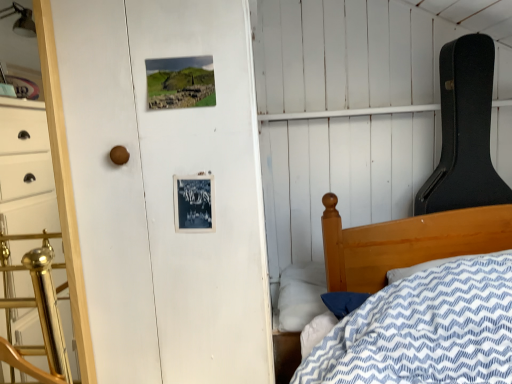
I want to click on white soft pillow at lower center, so click(x=301, y=295).

This screenshot has width=512, height=384. Describe the element at coordinates (301, 295) in the screenshot. I see `white soft pillow at lower center` at that location.

Locate an element on the screen. The width and height of the screenshot is (512, 384). brushed brass dresser at left is located at coordinates (30, 234).

The width and height of the screenshot is (512, 384). What do you see at coordinates (30, 234) in the screenshot?
I see `brushed brass dresser at left` at bounding box center [30, 234].

At what (x,y) coordinates should I click in order to perform the action: click on white soft pillow at lower center. Please return your answer as a coordinate pair (x, y). This screenshot has height=384, width=512. Looking at the image, I should click on (301, 295).

In the image, is brushed brass dresser at left on the left side or the right side of white soft pillow at lower center?

From the image, it's evident that brushed brass dresser at left is to the left of white soft pillow at lower center.

Which is behind, brushed brass dresser at left or white soft pillow at lower center?

white soft pillow at lower center.

Considering the positions of points (37, 311) and (282, 296), is point (37, 311) closer to camera compared to point (282, 296)?

Yes, point (37, 311) is in front of point (282, 296).

From the image's perspective, is brushed brass dresser at left located beneath white soft pillow at lower center?

No.

From a real-world perspective, which object stands above the other?

From a 3D spatial view, brushed brass dresser at left is above.

In the scene shown: Which object is wider, brushed brass dresser at left or white soft pillow at lower center?

With larger width is white soft pillow at lower center.

Between brushed brass dresser at left and white soft pillow at lower center, which one has more height?

brushed brass dresser at left is taller.

Is brushed brass dresser at left smaller than white soft pillow at lower center?

Yes.

Would you say brushed brass dresser at left contains white soft pillow at lower center?

Definitely not — white soft pillow at lower center is not inside brushed brass dresser at left.

Are brushed brass dresser at left and white soft pillow at lower center located far from each other?

No, there isn't a large distance between brushed brass dresser at left and white soft pillow at lower center.

Could you tell me if brushed brass dresser at left is facing white soft pillow at lower center?

No, brushed brass dresser at left is not facing towards white soft pillow at lower center.

How many degrees apart are the facing directions of brushed brass dresser at left and white soft pillow at lower center?

The angular difference between brushed brass dresser at left and white soft pillow at lower center is 0.829 degrees.

Where is `dresser lying above the white soft pillow at lower center (from the image's perspective)`? This screenshot has height=384, width=512. dresser lying above the white soft pillow at lower center (from the image's perspective) is located at coordinates (30, 234).

Is white soft pillow at lower center to the right of brushed brass dresser at left from the viewer's perspective?

Yes, white soft pillow at lower center is to the right of brushed brass dresser at left.

Is white soft pillow at lower center closer to the viewer compared to brushed brass dresser at left?

No.

Is point (285, 331) in front of point (7, 344)?

No, it is behind (7, 344).

From the image's perspective, does white soft pillow at lower center appear higher than brushed brass dresser at left?

No, from the image's perspective, white soft pillow at lower center is not over brushed brass dresser at left.

From a real-world perspective, is white soft pillow at lower center physically above brushed brass dresser at left?

Incorrect, from a real-world perspective, white soft pillow at lower center is lower than brushed brass dresser at left.

Which of these two, white soft pillow at lower center or brushed brass dresser at left, is wider?

With larger width is white soft pillow at lower center.

Which of these two, white soft pillow at lower center or brushed brass dresser at left, stands taller?

brushed brass dresser at left.

Can you confirm if white soft pillow at lower center is bigger than brushed brass dresser at left?

Yes, white soft pillow at lower center is bigger than brushed brass dresser at left.

Do you think white soft pillow at lower center is within brushed brass dresser at left, or outside of it?

white soft pillow at lower center exists outside the volume of brushed brass dresser at left.

Is white soft pillow at lower center placed right next to brushed brass dresser at left?

They are not placed beside each other.

Could you tell me if white soft pillow at lower center is turned towards brushed brass dresser at left?

No, white soft pillow at lower center is not oriented towards brushed brass dresser at left.

How different are the orientations of white soft pillow at lower center and brushed brass dresser at left in degrees?

white soft pillow at lower center and brushed brass dresser at left are facing 0.829 degrees away from each other.

Locate an element on the screen. This screenshot has width=512, height=384. dresser in front of the white soft pillow at lower center is located at coordinates (30, 234).

This screenshot has width=512, height=384. Identify the location of dresser that appears above the white soft pillow at lower center (from the image's perspective). (30, 234).

Where is `dresser that is on the left side of white soft pillow at lower center`? dresser that is on the left side of white soft pillow at lower center is located at coordinates (30, 234).